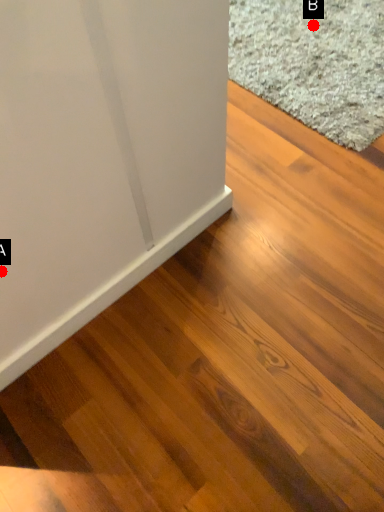
Question: Two points are circled on the image, labeled by A and B beside each circle. Which of the following is the closest to the observer?

Choices:
 (A) A is closer
 (B) B is closer

Answer: (A)